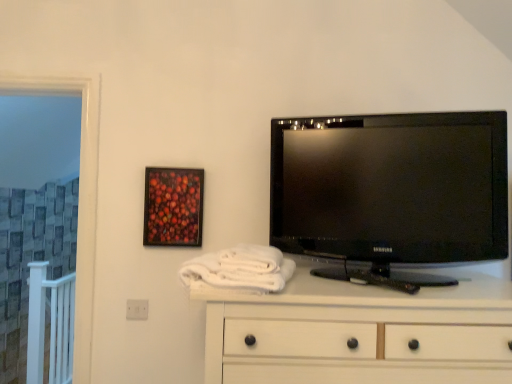
Question: Are white soft towel at center and black glossy tv at upper right located far from each other?

Choices:
 (A) yes
 (B) no

Answer: (B)

Question: From a real-world perspective, is white soft towel at center over black glossy tv at upper right?

Choices:
 (A) yes
 (B) no

Answer: (B)

Question: Does white soft towel at center appear on the left side of black glossy tv at upper right?

Choices:
 (A) no
 (B) yes

Answer: (B)

Question: Considering the relative positions of white soft towel at center and black glossy tv at upper right in the image provided, is white soft towel at center to the right of black glossy tv at upper right from the viewer's perspective?

Choices:
 (A) no
 (B) yes

Answer: (A)

Question: Is white soft towel at center aimed at black glossy tv at upper right?

Choices:
 (A) yes
 (B) no

Answer: (B)

Question: Is white soft towel at center in front of or behind white wood chest of drawers at lower center in the image?

Choices:
 (A) front
 (B) behind

Answer: (B)

Question: Is white soft towel at center taller or shorter than white wood chest of drawers at lower center?

Choices:
 (A) tall
 (B) short

Answer: (B)

Question: Would you say white soft towel at center is to the left or to the right of white wood chest of drawers at lower center in the picture?

Choices:
 (A) right
 (B) left

Answer: (B)

Question: From a real-world perspective, is white soft towel at center above or below white wood chest of drawers at lower center?

Choices:
 (A) above
 (B) below

Answer: (A)

Question: From the image's perspective, is white wood chest of drawers at lower center positioned above or below black glossy tv at upper right?

Choices:
 (A) below
 (B) above

Answer: (A)

Question: Is white wood chest of drawers at lower center in front of or behind black glossy tv at upper right in the image?

Choices:
 (A) front
 (B) behind

Answer: (A)

Question: Is point [x=327, y=372] positioned closer to the camera than point [x=306, y=162]?

Choices:
 (A) closer
 (B) farther

Answer: (A)

Question: In the image, is white wood chest of drawers at lower center on the left side or the right side of black glossy tv at upper right?

Choices:
 (A) right
 (B) left

Answer: (B)

Question: Is point (436, 334) positioned closer to the camera than point (176, 244)?

Choices:
 (A) closer
 (B) farther

Answer: (A)

Question: Considering the relative positions of white wood chest of drawers at lower center and wooden-framed artwork at upper left in the image provided, is white wood chest of drawers at lower center to the left or to the right of wooden-framed artwork at upper left?

Choices:
 (A) left
 (B) right

Answer: (B)